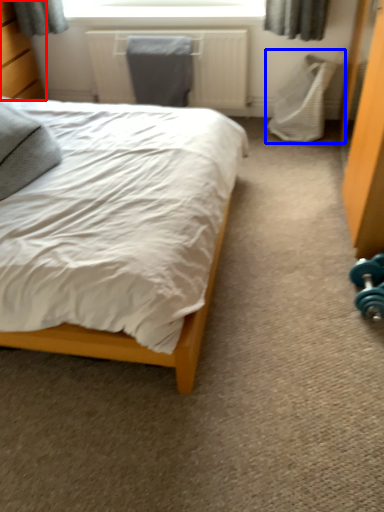
Question: Which object is closer to the camera taking this photo, dresser (highlighted by a red box) or swivel chair (highlighted by a blue box)?

Choices:
 (A) dresser
 (B) swivel chair

Answer: (A)